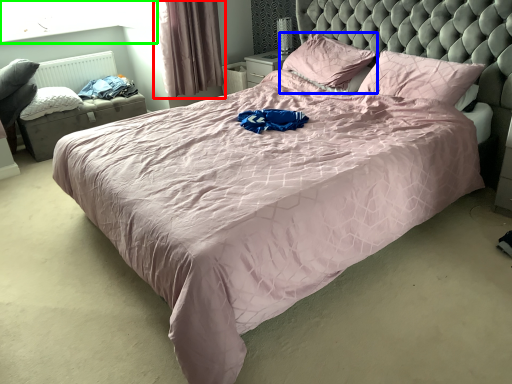
Question: Based on their relative distances, which object is farther from curtain (highlighted by a red box)? Choose from pillow (highlighted by a blue box) and window screen (highlighted by a green box).

Choices:
 (A) pillow
 (B) window screen

Answer: (A)